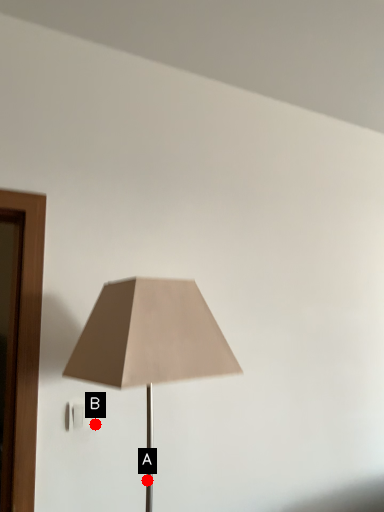
Question: Two points are circled on the image, labeled by A and B beside each circle. Which of the following is the farthest from the observer?

Choices:
 (A) A is further
 (B) B is further

Answer: (B)